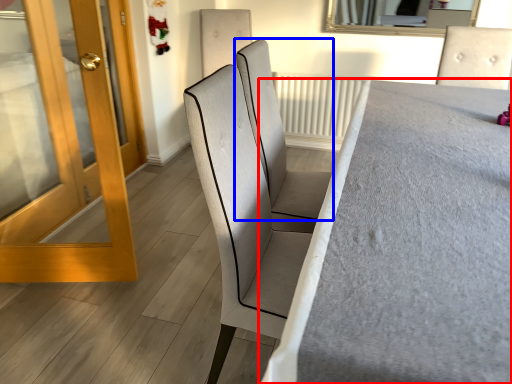
Question: Which object appears farthest to the camera in this image, furniture (highlighted by a red box) or chair (highlighted by a blue box)?

Choices:
 (A) furniture
 (B) chair

Answer: (B)